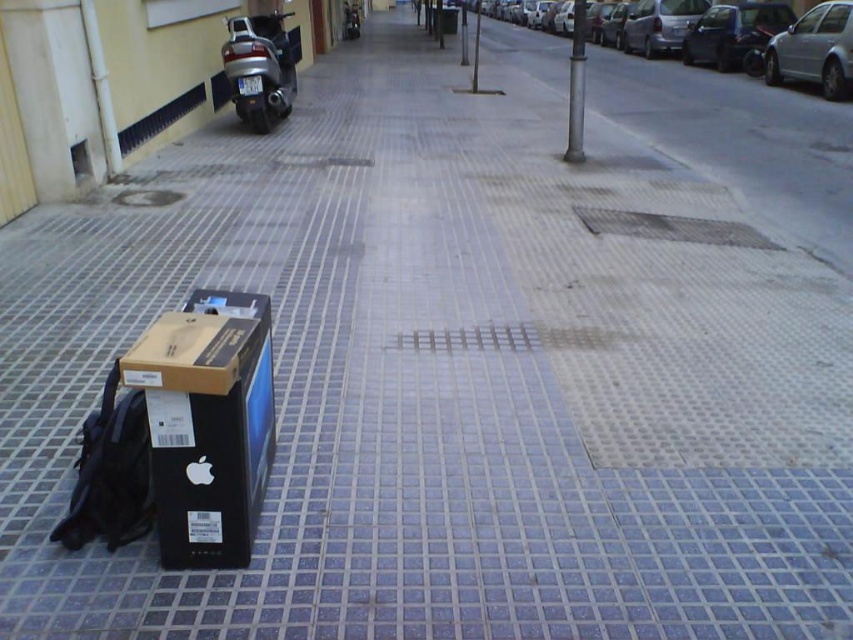
Question: Can you confirm if silver metallic sedan at right is thinner than silver metallic van at center right?

Choices:
 (A) no
 (B) yes

Answer: (B)

Question: Which point is farther from the camera taking this photo?

Choices:
 (A) (821, 56)
 (B) (344, 20)
 (C) (679, 83)
 (D) (743, 26)

Answer: (B)

Question: Which point is closer to the camera taking this photo?

Choices:
 (A) (740, 36)
 (B) (657, 4)
 (C) (602, 58)
 (D) (582, 58)

Answer: (D)

Question: From the image, what is the correct spatial relationship of silver metallic sedan at right in relation to metallic silver motorcycle at upper left?

Choices:
 (A) above
 (B) below

Answer: (A)

Question: Which of the following is the closest to the observer?

Choices:
 (A) metallic silver motorcycle at upper left
 (B) metallic silver motorcycle at upper center
 (C) silver metallic pole at center

Answer: (C)

Question: Is silver metallic sedan at right above metallic silver motorcycle at upper center?

Choices:
 (A) yes
 (B) no

Answer: (B)